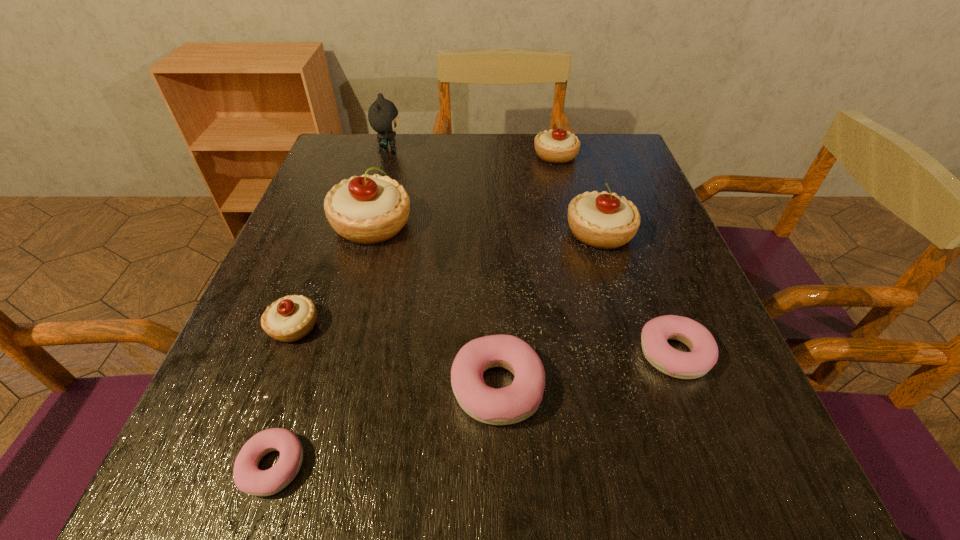
Choose which pink pastry is the nearest neighbor to the fifth shortest pastry. Please provide its 2D coordinates. Your answer should be formatted as a tuple, i.e. [(x, y)], where the tuple contains the x and y coordinates of a point satisfying the conditions above.

[(704, 351)]

Point out which pink pastry is positioned as the nearest to the kitten. Please provide its 2D coordinates. Your answer should be formatted as a tuple, i.e. [(x, y)], where the tuple contains the x and y coordinates of a point satisfying the conditions above.

[(512, 404)]

Where is `free point that satisfies the following two spatial constraints: 1. on the front-facing side of the kitten; 2. on the back side of the farthest pastry`? Image resolution: width=960 pixels, height=540 pixels. free point that satisfies the following two spatial constraints: 1. on the front-facing side of the kitten; 2. on the back side of the farthest pastry is located at coordinates (387, 156).

Where is `vacant space that satisfies the following two spatial constraints: 1. on the front-facing side of the sixth shortest object; 2. on the left side of the gray kitten`? vacant space that satisfies the following two spatial constraints: 1. on the front-facing side of the sixth shortest object; 2. on the left side of the gray kitten is located at coordinates (365, 233).

The width and height of the screenshot is (960, 540). I want to click on free space in the image that satisfies the following two spatial constraints: 1. on the back side of the second biggest beige pastry; 2. on the left side of the shortest object, so click(x=349, y=233).

Find the location of `vacant space that satisfies the following two spatial constraints: 1. on the front-facing side of the sixth shortest object; 2. on the left side of the kitten`. vacant space that satisfies the following two spatial constraints: 1. on the front-facing side of the sixth shortest object; 2. on the left side of the kitten is located at coordinates (365, 233).

The image size is (960, 540). I want to click on vacant space that satisfies the following two spatial constraints: 1. on the front side of the nearest pink pastry; 2. on the right side of the fourth tallest pastry, so click(241, 466).